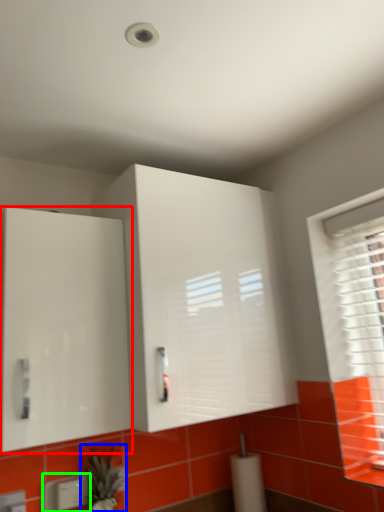
Question: Which object is the farthest from cabinetry (highlighted by a red box)? Choose among these: plant (highlighted by a blue box) or electric outlet (highlighted by a green box).

Choices:
 (A) plant
 (B) electric outlet

Answer: (B)